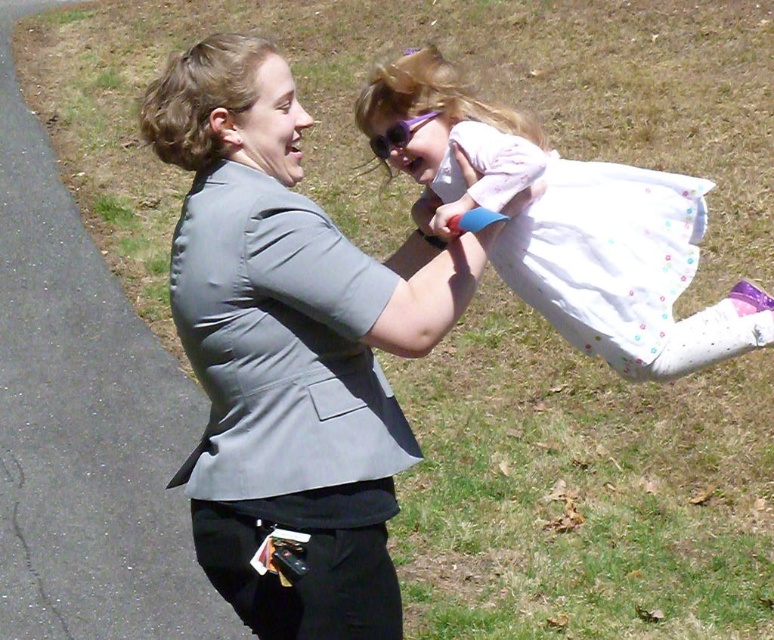
Is gray fabric jacket at center wider than white dotted dress at center?

No, gray fabric jacket at center is not wider than white dotted dress at center.

Between point (211, 458) and point (516, 236), which one is positioned behind?

Positioned behind is point (516, 236).

Image resolution: width=774 pixels, height=640 pixels. Find the location of `gray fabric jacket at center`. gray fabric jacket at center is located at coordinates (290, 348).

Where is `white dotted dress at center`? Image resolution: width=774 pixels, height=640 pixels. white dotted dress at center is located at coordinates (567, 225).

Between white dotted dress at center and purple plastic goggles at upper center, which one is positioned higher?

purple plastic goggles at upper center is higher up.

Image resolution: width=774 pixels, height=640 pixels. Describe the element at coordinates (567, 225) in the screenshot. I see `white dotted dress at center` at that location.

The width and height of the screenshot is (774, 640). Identify the location of white dotted dress at center. (567, 225).

Does gray fabric jacket at center appear on the left side of purple plastic goggles at upper center?

Indeed, gray fabric jacket at center is positioned on the left side of purple plastic goggles at upper center.

Who is more forward, (245, 432) or (378, 148)?

Positioned in front is point (245, 432).

Measure the distance between point (331, 417) and camera.

2.48 meters

Identify the location of gray fabric jacket at center. This screenshot has width=774, height=640. (290, 348).